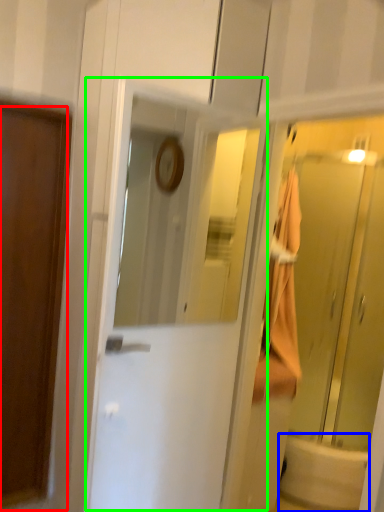
Question: Considering the real-world distances, which object is closest to door (highlighted by a red box)? bath (highlighted by a blue box) or door (highlighted by a green box).

Choices:
 (A) bath
 (B) door

Answer: (B)